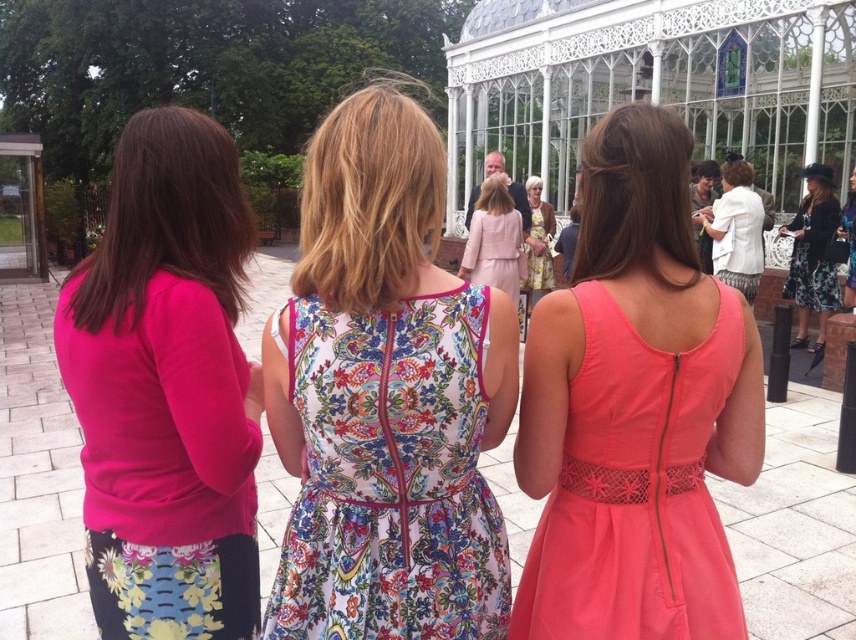
Question: Where is floral-patterned fabric dress at center located in relation to floral fabric dress at center in the image?

Choices:
 (A) above
 (B) below

Answer: (B)

Question: Is matte pink sweater at left thinner than coral satin dress at center?

Choices:
 (A) no
 (B) yes

Answer: (A)

Question: Among these objects, which one is farthest from the camera?

Choices:
 (A) floral-patterned fabric dress at center
 (B) matte pink sweater at left
 (C) coral satin dress at center
 (D) floral fabric dress at center

Answer: (D)

Question: Which of the following is the closest to the observer?

Choices:
 (A) (750, 276)
 (B) (625, 372)
 (C) (539, 188)

Answer: (B)

Question: Is floral dress at right positioned before white textured dress at right?

Choices:
 (A) yes
 (B) no

Answer: (A)

Question: Which of the following is the closest to the observer?

Choices:
 (A) white textured dress at right
 (B) matte pink sweater at left

Answer: (B)